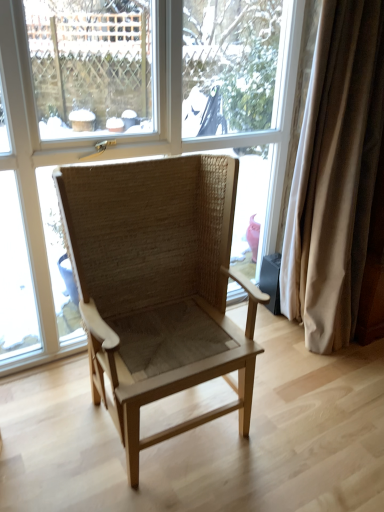
Find the location of `beige fabric curtain at right`. beige fabric curtain at right is located at coordinates (335, 175).

Describe the element at coordinates (335, 175) in the screenshot. I see `beige fabric curtain at right` at that location.

In order to click on natural woven chair at center in this screenshot , I will do [158, 286].

Describe the element at coordinates (131, 129) in the screenshot. I see `transparent glass window at center` at that location.

Locate an element on the screen. This screenshot has width=384, height=512. beige fabric curtain at right is located at coordinates (335, 175).

Is transparent glass window at center facing towards natural woven chair at center?

Yes, transparent glass window at center is oriented towards natural woven chair at center.

Does point (15, 5) appear closer or farther from the camera than point (185, 252)?

Clearly, point (15, 5) is closer to the camera than point (185, 252).

I want to click on window located above the natural woven chair at center (from the image's perspective), so click(131, 129).

In terms of width, does transparent glass window at center look wider or thinner when compared to natural woven chair at center?

Clearly, transparent glass window at center has less width compared to natural woven chair at center.

The height and width of the screenshot is (512, 384). What are the coordinates of `window to the left of beige fabric curtain at right` in the screenshot? It's located at (131, 129).

From the image's perspective, between transparent glass window at center and beige fabric curtain at right, who is located below?

beige fabric curtain at right.

Is transparent glass window at center smaller than beige fabric curtain at right?

No.

Considering the points (330, 200) and (96, 355), which point is in front, point (330, 200) or point (96, 355)?

The point (96, 355) is in front.

From the image's perspective, would you say beige fabric curtain at right is shown under natural woven chair at center?

No, from the image's perspective, beige fabric curtain at right is not beneath natural woven chair at center.

In the image, is beige fabric curtain at right on the left side or the right side of natural woven chair at center?

beige fabric curtain at right is to the right of natural woven chair at center.

At what (x,y) coordinates should I click in order to perform the action: click on chair below the beige fabric curtain at right (from a real-world perspective). Please return your answer as a coordinate pair (x, y). Image resolution: width=384 pixels, height=512 pixels. Looking at the image, I should click on (158, 286).

Based on the photo, who is bigger, beige fabric curtain at right or transparent glass window at center?

Bigger between the two is transparent glass window at center.

Considering the relative positions of beige fabric curtain at right and transparent glass window at center in the image provided, is beige fabric curtain at right to the left or to the right of transparent glass window at center?

In the image, beige fabric curtain at right appears on the right side of transparent glass window at center.

Is beige fabric curtain at right looking in the opposite direction of transparent glass window at center?

Yes, beige fabric curtain at right's orientation is away from transparent glass window at center.

Could you tell me if natural woven chair at center is facing transparent glass window at center?

No, natural woven chair at center does not turn towards transparent glass window at center.

Would you say natural woven chair at center is inside or outside transparent glass window at center?

natural woven chair at center is not enclosed by transparent glass window at center.

Considering the relative sizes of natural woven chair at center and transparent glass window at center in the image provided, is natural woven chair at center bigger than transparent glass window at center?

Yes, natural woven chair at center is bigger than transparent glass window at center.

From a real-world perspective, is natural woven chair at center positioned over transparent glass window at center based on gravity?

No, from a real-world perspective, natural woven chair at center is not over transparent glass window at center

Based on the photo, is natural woven chair at center located outside beige fabric curtain at right?

Yes.

Based on their sizes in the image, would you say natural woven chair at center is bigger or smaller than beige fabric curtain at right?

In the image, natural woven chair at center appears to be larger than beige fabric curtain at right.

Which object is more forward, natural woven chair at center or beige fabric curtain at right?

natural woven chair at center is in front.

Locate an element on the screen. window lying behind the natural woven chair at center is located at coordinates pyautogui.click(x=131, y=129).

Locate an element on the screen. This screenshot has width=384, height=512. curtain below the transparent glass window at center (from the image's perspective) is located at coordinates (335, 175).

Estimate the real-world distances between objects in this image. Which object is further from beige fabric curtain at right, transparent glass window at center or natural woven chair at center?

transparent glass window at center.

Which object lies further to the anchor point transparent glass window at center, beige fabric curtain at right or natural woven chair at center?

The object further to transparent glass window at center is beige fabric curtain at right.

When comparing their distances from natural woven chair at center, does transparent glass window at center or beige fabric curtain at right seem closer?

Based on the image, transparent glass window at center appears to be nearer to natural woven chair at center.

When comparing their distances from natural woven chair at center, does beige fabric curtain at right or transparent glass window at center seem further?

The object further to natural woven chair at center is beige fabric curtain at right.

Estimate the real-world distances between objects in this image. Which object is further from transparent glass window at center, natural woven chair at center or beige fabric curtain at right?

Based on the image, beige fabric curtain at right appears to be further to transparent glass window at center.

Looking at the image, which one is located closer to beige fabric curtain at right, natural woven chair at center or transparent glass window at center?

natural woven chair at center lies closer to beige fabric curtain at right than the other object.

Where is `chair between transparent glass window at center and beige fabric curtain at right from left to right`? Image resolution: width=384 pixels, height=512 pixels. chair between transparent glass window at center and beige fabric curtain at right from left to right is located at coordinates (158, 286).